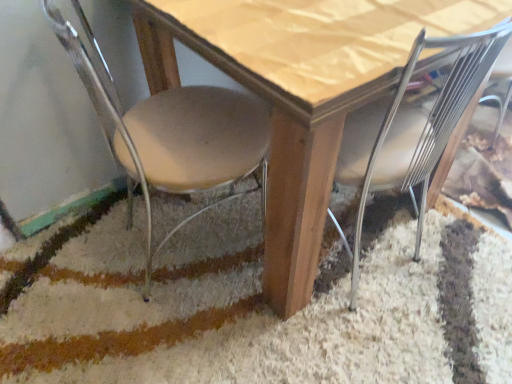
What is the approximate height of beige fabric chair at lower left, acting as the second chair starting from the right?

The height of beige fabric chair at lower left, acting as the second chair starting from the right, is 31.60 inches.

Locate an element on the screen. wooden table at center is located at coordinates (300, 92).

Considering the sizes of objects metallic silver chair at lower right, the second chair when ordered from left to right, and wooden table at center in the image provided, who is shorter, metallic silver chair at lower right, the second chair when ordered from left to right, or wooden table at center?

Standing shorter between the two is wooden table at center.

Identify the location of table in front of the metallic silver chair at lower right, positioned as the first chair in right-to-left order. (300, 92).

Is metallic silver chair at lower right, positioned as the first chair in right-to-left order, placed right next to wooden table at center?

No, metallic silver chair at lower right, positioned as the first chair in right-to-left order, is not making contact with wooden table at center.

From the picture: Is metallic silver chair at lower right, the second chair when ordered from left to right, not inside beige fabric chair at lower left, acting as the second chair starting from the right?

That's correct, metallic silver chair at lower right, the second chair when ordered from left to right, is outside of beige fabric chair at lower left, acting as the second chair starting from the right.

Is metallic silver chair at lower right, positioned as the first chair in right-to-left order, turned away from beige fabric chair at lower left, acting as the second chair starting from the right?

That's not correct — metallic silver chair at lower right, positioned as the first chair in right-to-left order, is not looking away from beige fabric chair at lower left, acting as the second chair starting from the right.

Based on the photo, between metallic silver chair at lower right, the second chair when ordered from left to right, and beige fabric chair at lower left, acting as the second chair starting from the right, which one appears on the right side from the viewer's perspective?

metallic silver chair at lower right, the second chair when ordered from left to right, is more to the right.

Are metallic silver chair at lower right, the second chair when ordered from left to right, and beige fabric chair at lower left, the 1th chair in the left-to-right sequence, beside each other?

There is a gap between metallic silver chair at lower right, the second chair when ordered from left to right, and beige fabric chair at lower left, the 1th chair in the left-to-right sequence.

Is wooden table at center in front of or behind beige fabric chair at lower left, the 1th chair in the left-to-right sequence, in the image?

Visually, wooden table at center is located behind beige fabric chair at lower left, the 1th chair in the left-to-right sequence.

In order to click on chair in front of the wooden table at center in this screenshot , I will do `click(172, 131)`.

Is wooden table at center facing towards beige fabric chair at lower left, the 1th chair in the left-to-right sequence?

No.

From the image's perspective, is wooden table at center over beige fabric chair at lower left, the 1th chair in the left-to-right sequence?

Yes, from the image's perspective, wooden table at center is on top of beige fabric chair at lower left, the 1th chair in the left-to-right sequence.

Does wooden table at center lie behind metallic silver chair at lower right, the second chair when ordered from left to right?

No, wooden table at center is closer to the camera.

Locate an element on the screen. This screenshot has width=512, height=384. chair on the right of wooden table at center is located at coordinates (433, 120).

Does wooden table at center have a larger size compared to metallic silver chair at lower right, the second chair when ordered from left to right?

Correct, wooden table at center is larger in size than metallic silver chair at lower right, the second chair when ordered from left to right.

Would you say wooden table at center is outside metallic silver chair at lower right, the second chair when ordered from left to right?

Yes, wooden table at center is located beyond the bounds of metallic silver chair at lower right, the second chair when ordered from left to right.

From a real-world perspective, which is physically below, beige fabric chair at lower left, the 1th chair in the left-to-right sequence, or wooden table at center?

From a 3D spatial view, wooden table at center is below.

In terms of width, does beige fabric chair at lower left, the 1th chair in the left-to-right sequence, look wider or thinner when compared to wooden table at center?

Clearly, beige fabric chair at lower left, the 1th chair in the left-to-right sequence, has less width compared to wooden table at center.

Does point (183, 120) come behind point (342, 100)?

Yes.

Between beige fabric chair at lower left, acting as the second chair starting from the right, and wooden table at center, which one has more height?

With more height is beige fabric chair at lower left, acting as the second chair starting from the right.

From a real-world perspective, is beige fabric chair at lower left, acting as the second chair starting from the right, below metallic silver chair at lower right, positioned as the first chair in right-to-left order?

Indeed, from a real-world perspective, beige fabric chair at lower left, acting as the second chair starting from the right, is positioned beneath metallic silver chair at lower right, positioned as the first chair in right-to-left order.

Relative to metallic silver chair at lower right, positioned as the first chair in right-to-left order, is beige fabric chair at lower left, the 1th chair in the left-to-right sequence, in front or behind?

Clearly, beige fabric chair at lower left, the 1th chair in the left-to-right sequence, is in front of metallic silver chair at lower right, positioned as the first chair in right-to-left order.

Where is `chair in front of the metallic silver chair at lower right, the second chair when ordered from left to right`? This screenshot has height=384, width=512. chair in front of the metallic silver chair at lower right, the second chair when ordered from left to right is located at coordinates (172, 131).

From the picture: Between beige fabric chair at lower left, acting as the second chair starting from the right, and metallic silver chair at lower right, the second chair when ordered from left to right, which one has larger size?

beige fabric chair at lower left, acting as the second chair starting from the right, is bigger.

Identify the location of the 2nd chair below when counting from the wooden table at center (from the image's perspective). Image resolution: width=512 pixels, height=384 pixels. (433, 120).

Locate an element on the screen. The image size is (512, 384). chair above the beige fabric chair at lower left, acting as the second chair starting from the right (from a real-world perspective) is located at coordinates (433, 120).

Which object lies nearer to the anchor point metallic silver chair at lower right, positioned as the first chair in right-to-left order, beige fabric chair at lower left, acting as the second chair starting from the right, or wooden table at center?

The object closer to metallic silver chair at lower right, positioned as the first chair in right-to-left order, is wooden table at center.

Estimate the real-world distances between objects in this image. Which object is further from beige fabric chair at lower left, the 1th chair in the left-to-right sequence, metallic silver chair at lower right, positioned as the first chair in right-to-left order, or wooden table at center?

metallic silver chair at lower right, positioned as the first chair in right-to-left order.

From the image, which object appears to be farther from beige fabric chair at lower left, the 1th chair in the left-to-right sequence, wooden table at center or metallic silver chair at lower right, the second chair when ordered from left to right?

metallic silver chair at lower right, the second chair when ordered from left to right.

Which object lies further to the anchor point wooden table at center, beige fabric chair at lower left, acting as the second chair starting from the right, or metallic silver chair at lower right, the second chair when ordered from left to right?

metallic silver chair at lower right, the second chair when ordered from left to right, is further to wooden table at center.

From the image, which object appears to be farther from metallic silver chair at lower right, the second chair when ordered from left to right, wooden table at center or beige fabric chair at lower left, the 1th chair in the left-to-right sequence?

beige fabric chair at lower left, the 1th chair in the left-to-right sequence, is positioned further to the anchor metallic silver chair at lower right, the second chair when ordered from left to right.

From the image, which object appears to be nearer to wooden table at center, metallic silver chair at lower right, positioned as the first chair in right-to-left order, or beige fabric chair at lower left, the 1th chair in the left-to-right sequence?

beige fabric chair at lower left, the 1th chair in the left-to-right sequence, lies closer to wooden table at center than the other object.

Image resolution: width=512 pixels, height=384 pixels. I want to click on table located between beige fabric chair at lower left, acting as the second chair starting from the right, and metallic silver chair at lower right, positioned as the first chair in right-to-left order, in the left-right direction, so click(x=300, y=92).